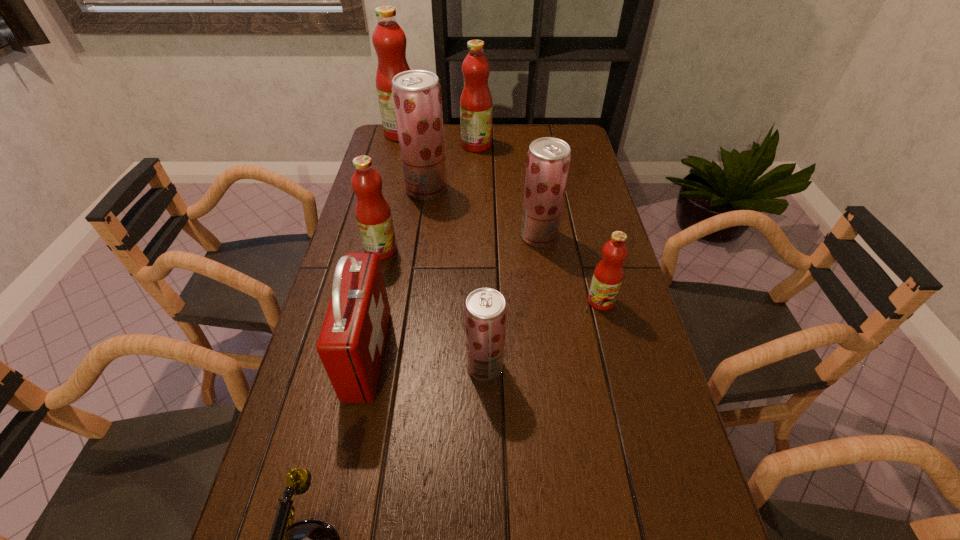
You are a GUI agent. You are given a task and a screenshot of the screen. Output one action in this format:
    pyautogui.click(x=<x>, y=<y>)
    Task: Click on the strawberry fruit juice that can be found as the second closest to the seventh nearest object
    Image resolution: width=960 pixels, height=540 pixels.
    Given the screenshot: What is the action you would take?
    pyautogui.click(x=485, y=309)

Locate an element on the screen. vacant region that satisfies the following two spatial constraints: 1. on the front label of the tallest fruit juice; 2. on the back side of the biggest strawberry fruit juice is located at coordinates (388, 190).

At what (x,y) coordinates should I click in order to perform the action: click on free space that satisfies the following two spatial constraints: 1. on the front face of the red first-aid kit; 2. on the right side of the nearest strawberry fruit juice. Please return your answer as a coordinate pair (x, y). The image size is (960, 540). Looking at the image, I should click on (366, 366).

Locate an element on the screen. free space that satisfies the following two spatial constraints: 1. on the front side of the biggest strawberry fruit juice; 2. on the right side of the rightmost strawberry fruit juice is located at coordinates (420, 236).

Locate an element on the screen. The width and height of the screenshot is (960, 540). vacant space that satisfies the following two spatial constraints: 1. on the front label of the smallest pink fruit juice; 2. on the front face of the red first-aid kit is located at coordinates [614, 354].